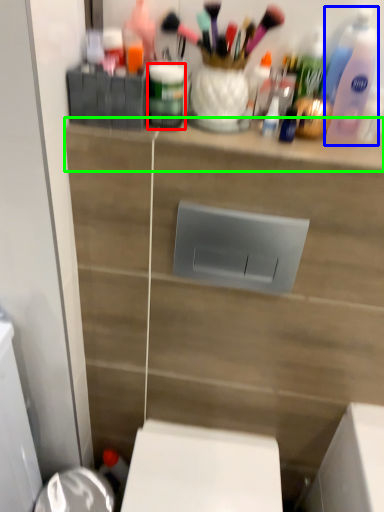
Question: Which object is the farthest from toiletry (highlighted by a red box)? Choose among these: cleaning product (highlighted by a blue box) or ledge (highlighted by a green box).

Choices:
 (A) cleaning product
 (B) ledge

Answer: (A)